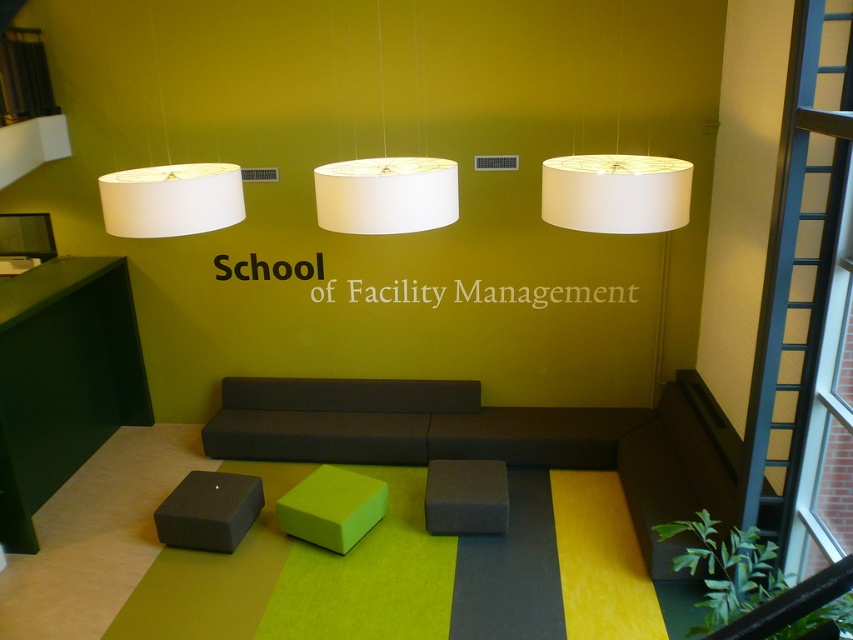
Who is shorter, white matte lampshade at center or matte gray stool at center?

With less height is matte gray stool at center.

Can you confirm if white matte lampshade at center is shorter than matte gray stool at center?

In fact, white matte lampshade at center may be taller than matte gray stool at center.

Image resolution: width=853 pixels, height=640 pixels. What do you see at coordinates (386, 195) in the screenshot? I see `white matte lampshade at center` at bounding box center [386, 195].

You are a GUI agent. You are given a task and a screenshot of the screen. Output one action in this format:
    pyautogui.click(x=<x>, y=<y>)
    Task: Click on the white matte lampshade at center
    This screenshot has height=640, width=853.
    Given the screenshot: What is the action you would take?
    pyautogui.click(x=386, y=195)

How much distance is there between dark gray fabric couch at center and white matte lampshade at upper right?

The distance of dark gray fabric couch at center from white matte lampshade at upper right is 9.57 feet.

Is dark gray fabric couch at center taller than white matte lampshade at upper right?

Yes.

Locate an element on the screen. The width and height of the screenshot is (853, 640). dark gray fabric couch at center is located at coordinates (331, 419).

Locate an element on the screen. Image resolution: width=853 pixels, height=640 pixels. dark gray fabric couch at center is located at coordinates (331, 419).

Does white matte lampshade at upper center have a greater height compared to matte gray stool at lower left?

Indeed, white matte lampshade at upper center has a greater height compared to matte gray stool at lower left.

Is point (183, 230) positioned behind point (173, 512)?

No, it is in front of (173, 512).

You are a GUI agent. You are given a task and a screenshot of the screen. Output one action in this format:
    pyautogui.click(x=<x>, y=<y>)
    Task: Click on the white matte lampshade at upper center
    The width and height of the screenshot is (853, 640).
    Given the screenshot: What is the action you would take?
    pyautogui.click(x=171, y=198)